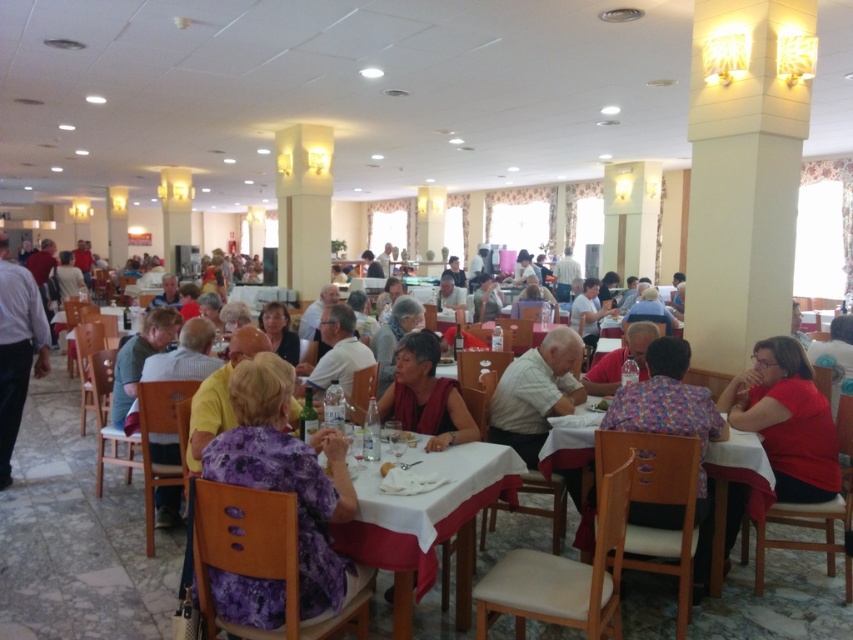
Looking at this image, you are a photographer standing at the front of the dining area and want to take a clear photo of the white cloth table at center. The camera you are using has a minimum focus distance of 8 feet. Will you be able to focus on the table without moving closer?

The white cloth table at center is 7.66 feet away from the camera. Since the minimum focus distance is 8 feet, the camera cannot focus on the table from this distance. You need to move back or adjust your position to increase the distance to at least 8 feet.

You are a waiter carrying a tray of dishes and need to reach the kitchen located behind the tables. Which table should you go around to access the kitchen? The options are the white cloth table at center and the white wood table at center.

The white cloth table at center is in front of the white wood table at center, so you should go around the white wood table at center to access the kitchen located behind them.

You are a server in the restaurant and need to deliver a tray of drinks to the table. The tray is heavy, so you want to avoid walking under any hanging objects. Is the path to the white cloth table at center clear of the floral fabric shirt at right?

The white cloth table at center is positioned under the floral fabric shirt at right, meaning the shirt is hanging above the table. Therefore, the path to the table is not clear, and you should avoid walking directly under the shirt to prevent it from being disturbed.